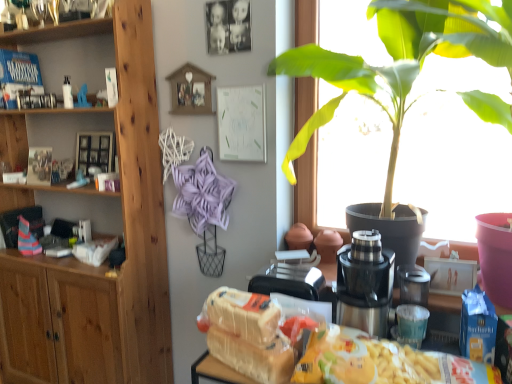
Question: Is white bread at center oriented away from satin silver blender at center?

Choices:
 (A) yes
 (B) no

Answer: (B)

Question: Is the position of white bread at center less distant than that of satin silver blender at center?

Choices:
 (A) yes
 (B) no

Answer: (A)

Question: Is the position of white bread at center more distant than that of satin silver blender at center?

Choices:
 (A) no
 (B) yes

Answer: (A)

Question: From a real-world perspective, is white bread at center located higher than satin silver blender at center?

Choices:
 (A) no
 (B) yes

Answer: (A)

Question: Considering the relative positions of white bread at center and satin silver blender at center in the image provided, is white bread at center to the left of satin silver blender at center from the viewer's perspective?

Choices:
 (A) yes
 (B) no

Answer: (A)

Question: From the image's perspective, is white bread at center located above satin silver blender at center?

Choices:
 (A) no
 (B) yes

Answer: (A)

Question: Is metallic silver coffee machine at center surrounding white bread at center?

Choices:
 (A) no
 (B) yes

Answer: (A)

Question: Is metallic silver coffee machine at center next to white bread at center and touching it?

Choices:
 (A) no
 (B) yes

Answer: (A)

Question: Considering the relative sizes of metallic silver coffee machine at center and white bread at center in the image provided, is metallic silver coffee machine at center smaller than white bread at center?

Choices:
 (A) no
 (B) yes

Answer: (A)

Question: Does metallic silver coffee machine at center appear on the right side of white bread at center?

Choices:
 (A) no
 (B) yes

Answer: (B)

Question: Is metallic silver coffee machine at center taller than white bread at center?

Choices:
 (A) yes
 (B) no

Answer: (A)

Question: Can you confirm if metallic silver coffee machine at center is positioned to the left of white bread at center?

Choices:
 (A) no
 (B) yes

Answer: (A)

Question: Considering the relative sizes of satin silver blender at center and matte blue toy at left in the image provided, is satin silver blender at center bigger than matte blue toy at left?

Choices:
 (A) no
 (B) yes

Answer: (B)